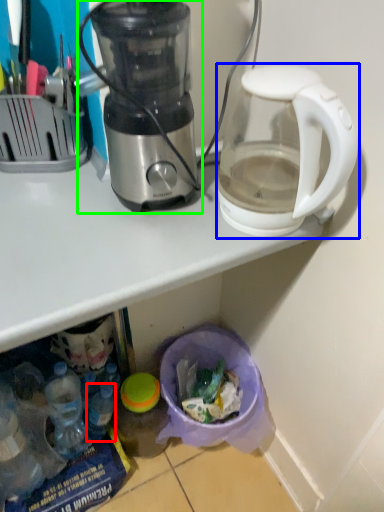
Question: Which is farther away from bottle (highlighted by a red box)? coffee maker (highlighted by a blue box) or blender (highlighted by a green box)?

Choices:
 (A) coffee maker
 (B) blender

Answer: (A)